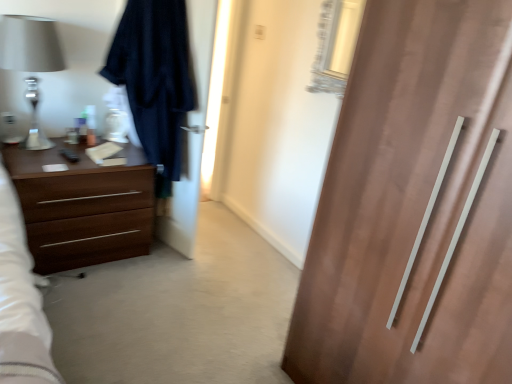
Question: Considering the relative sizes of brown wood chest of drawers at left and matte silver lamp at left in the image provided, is brown wood chest of drawers at left smaller than matte silver lamp at left?

Choices:
 (A) no
 (B) yes

Answer: (A)

Question: From a real-world perspective, does brown wood chest of drawers at left sit lower than matte silver lamp at left?

Choices:
 (A) yes
 (B) no

Answer: (A)

Question: Can you confirm if brown wood chest of drawers at left is wider than matte silver lamp at left?

Choices:
 (A) yes
 (B) no

Answer: (A)

Question: Does brown wood chest of drawers at left have a lesser width compared to matte silver lamp at left?

Choices:
 (A) yes
 (B) no

Answer: (B)

Question: Is brown wood chest of drawers at left aimed at matte silver lamp at left?

Choices:
 (A) yes
 (B) no

Answer: (B)

Question: Considering the relative positions of brown wood chest of drawers at left and matte silver lamp at left in the image provided, is brown wood chest of drawers at left to the right of matte silver lamp at left from the viewer's perspective?

Choices:
 (A) no
 (B) yes

Answer: (B)

Question: Is brown wood chest of drawers at left not inside dark blue fabric robe at left?

Choices:
 (A) yes
 (B) no

Answer: (B)

Question: Is brown wood chest of drawers at left directly adjacent to dark blue fabric robe at left?

Choices:
 (A) yes
 (B) no

Answer: (B)

Question: Is brown wood chest of drawers at left positioned in front of dark blue fabric robe at left?

Choices:
 (A) no
 (B) yes

Answer: (A)

Question: Can you confirm if brown wood chest of drawers at left is bigger than dark blue fabric robe at left?

Choices:
 (A) no
 (B) yes

Answer: (A)

Question: From a real-world perspective, is brown wood chest of drawers at left positioned over dark blue fabric robe at left based on gravity?

Choices:
 (A) yes
 (B) no

Answer: (B)

Question: Is dark blue fabric robe at left surrounded by brown wood chest of drawers at left?

Choices:
 (A) no
 (B) yes

Answer: (A)

Question: Is dark fabric screen door at left in contact with dark blue fabric robe at left?

Choices:
 (A) yes
 (B) no

Answer: (B)